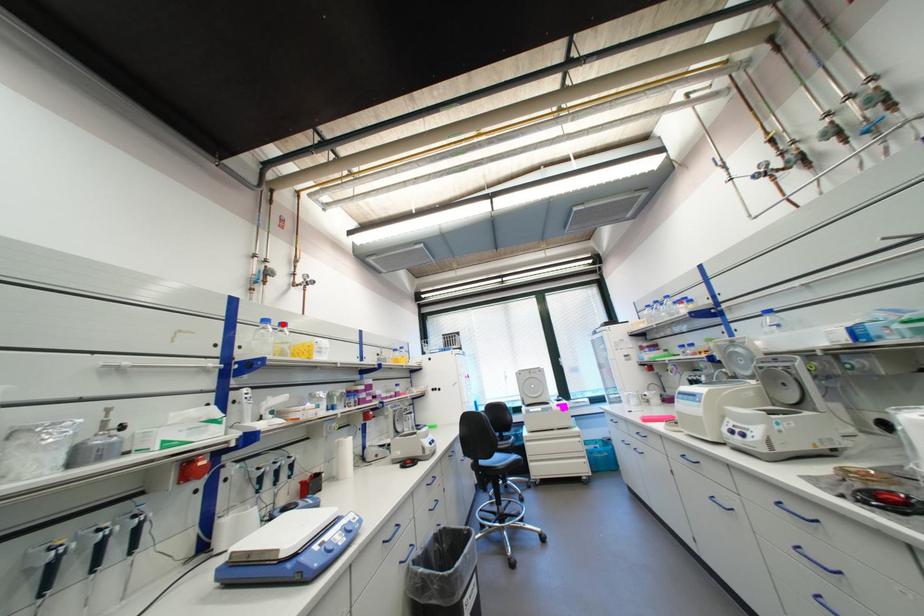
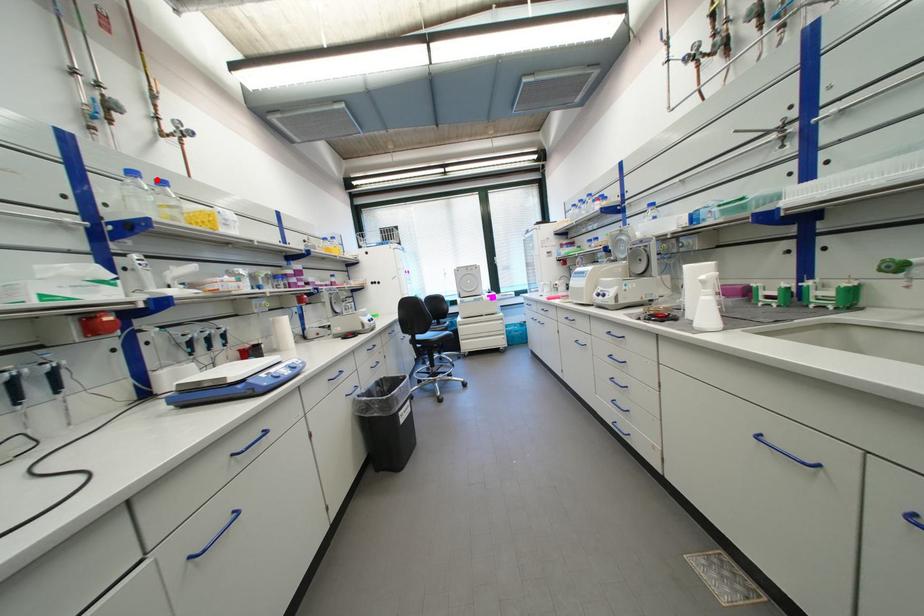
I am providing you with two images of the same scene from different viewpoints. A red point is marked on the first image and another point is marked on the second image. Is the marked point in image1 the same physical position as the marked point in image2?

Yes